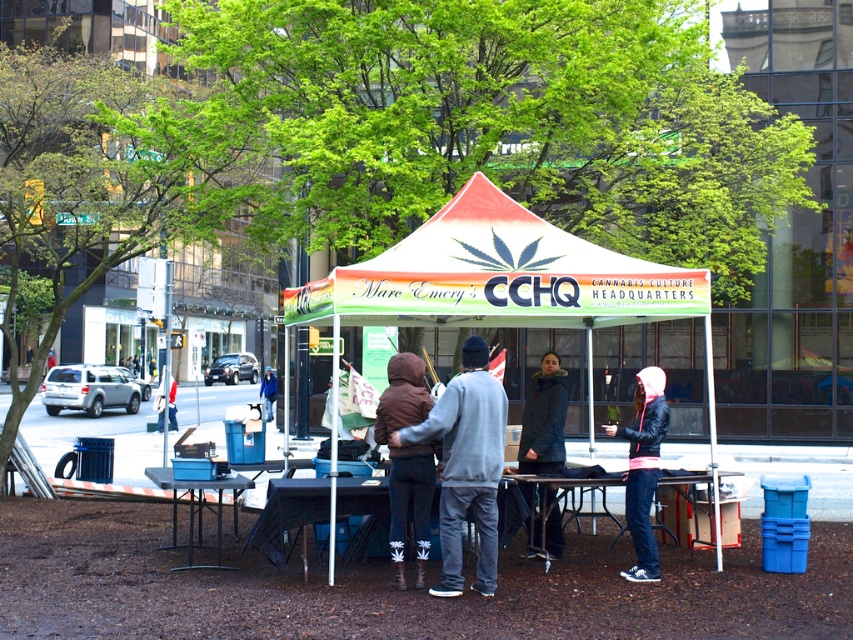
Question: Can you confirm if white fabric tent at center is positioned to the left of black plastic table at lower left?

Choices:
 (A) no
 (B) yes

Answer: (A)

Question: In this image, where is matte gray hoodie at center located relative to pink leather jacket at lower right?

Choices:
 (A) below
 (B) above

Answer: (B)

Question: Estimate the real-world distances between objects in this image. Which object is farther from the matte gray hoodie at center?

Choices:
 (A) pink leather jacket at lower right
 (B) dark blue fur-lined coat at center
 (C) black plastic table at lower left

Answer: (C)

Question: Which of the following is the closest to the observer?

Choices:
 (A) pink leather jacket at lower right
 (B) dark blue fur-lined coat at center

Answer: (A)

Question: Which point appears closest to the camera in this image?

Choices:
 (A) (558, 541)
 (B) (291, 314)
 (C) (192, 516)
 (D) (651, 554)

Answer: (D)

Question: Can you confirm if white fabric tent at center is smaller than dark blue fur-lined coat at center?

Choices:
 (A) yes
 (B) no

Answer: (A)